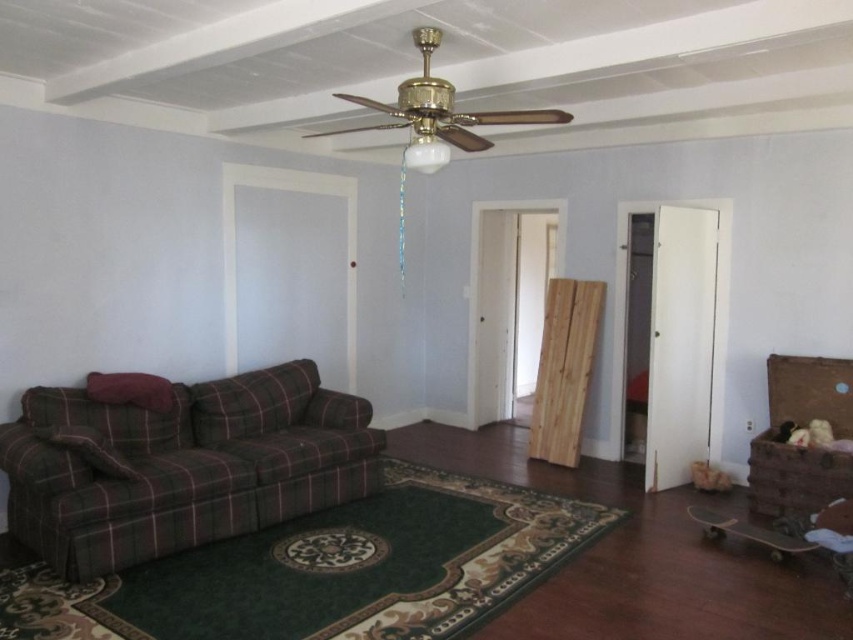
Is plaid fabric couch at lower left behind brown wicker chest at right?

No, it is in front of brown wicker chest at right.

Does point (334, 445) come closer to viewer compared to point (805, 481)?

No.

Which is in front, point (71, 563) or point (816, 388)?

Point (71, 563)

Identify the location of plaid fabric couch at lower left. The image size is (853, 640). (180, 465).